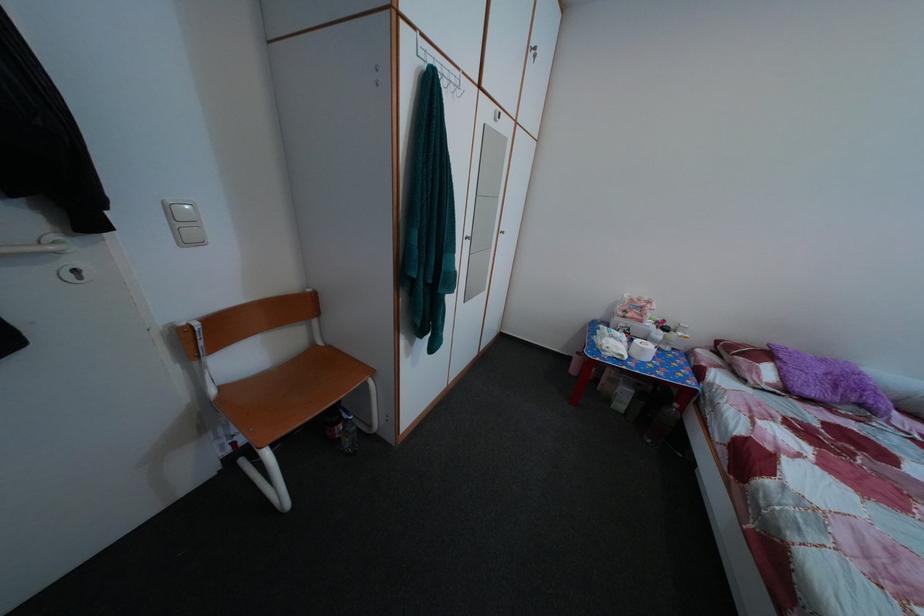
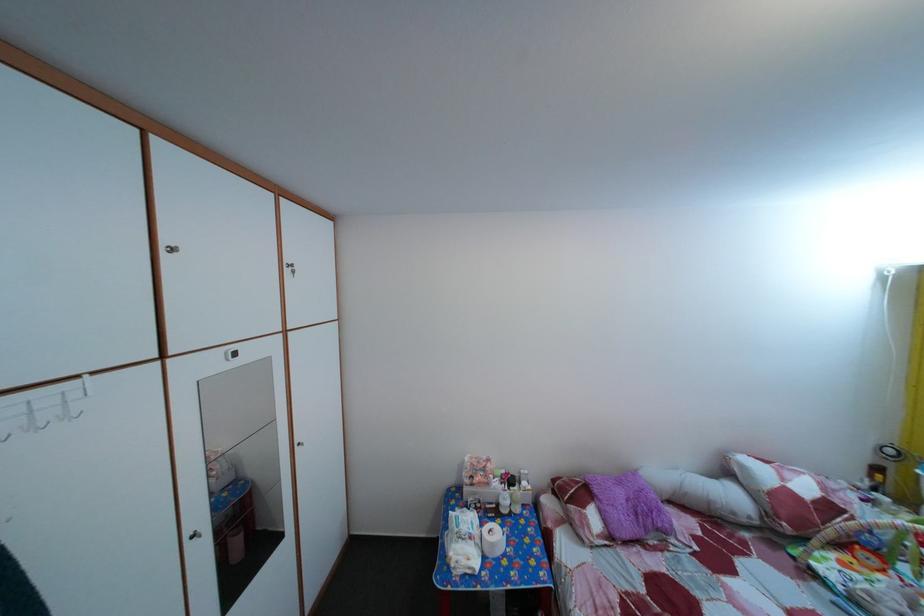
Where in the second image is the point corresponding to [544,63] from the first image?

(304, 280)